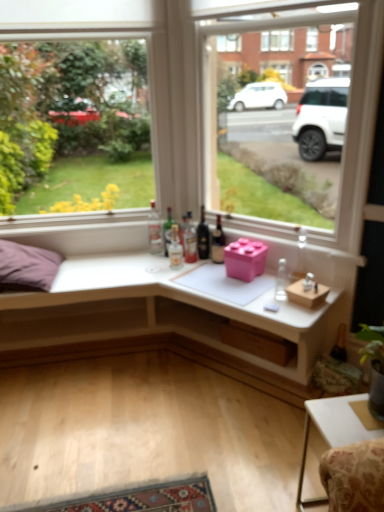
Where is `free space to the left of translucent glass bottle at center, which ranks as the 2th bottle in left-to-right order`? free space to the left of translucent glass bottle at center, which ranks as the 2th bottle in left-to-right order is located at coordinates (140, 258).